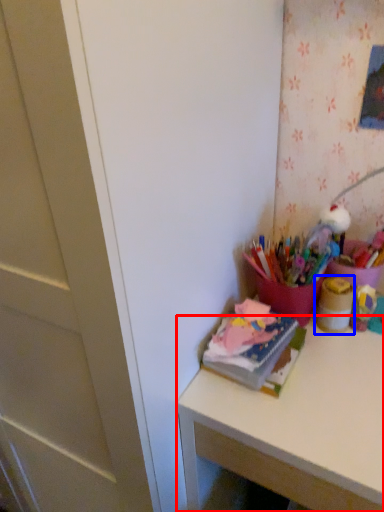
Question: Which point is further to the camera, desk (highlighted by a red box) or stationery (highlighted by a blue box)?

Choices:
 (A) desk
 (B) stationery

Answer: (B)